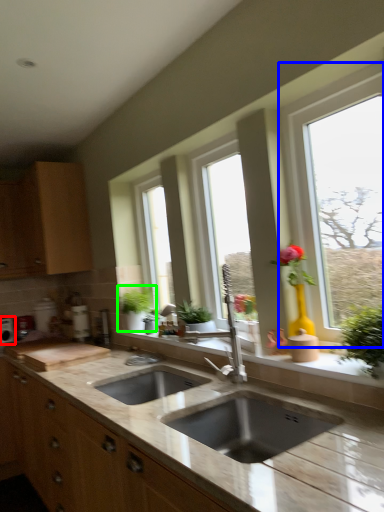
Question: Which object is the farthest from appliance (highlighted by a red box)? Choose among these: window (highlighted by a blue box) or houseplant (highlighted by a green box).

Choices:
 (A) window
 (B) houseplant

Answer: (A)